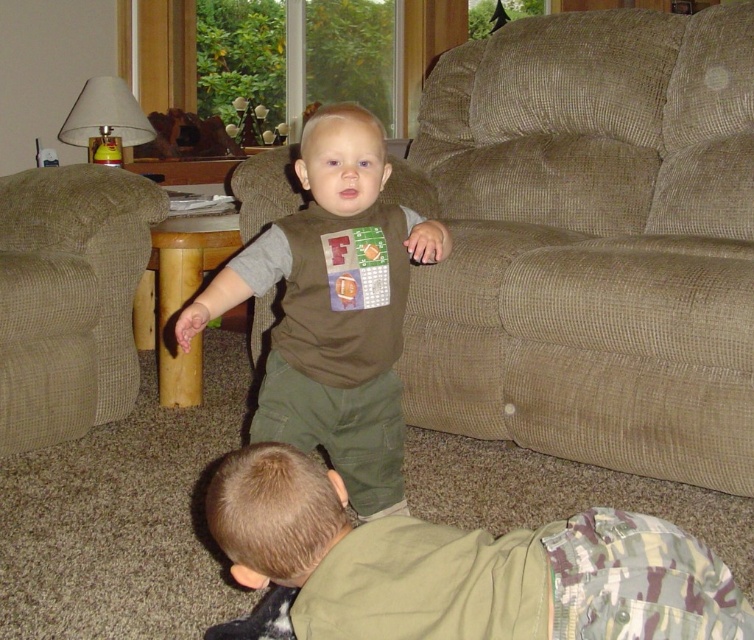
Question: Which of these objects is positioned closest to the camouflage pants at lower center?

Choices:
 (A) brown matte shirt at center
 (B) brown corduroy couch at center

Answer: (A)

Question: Does brown corduroy couch at center appear over beige corduroy armchair at left?

Choices:
 (A) no
 (B) yes

Answer: (B)

Question: Does camouflage pants at lower center have a larger size compared to brown matte shirt at center?

Choices:
 (A) no
 (B) yes

Answer: (A)

Question: Which is nearer to the brown matte shirt at center?

Choices:
 (A) brown corduroy couch at center
 (B) camouflage pants at lower center
 (C) beige corduroy armchair at left

Answer: (A)

Question: Does brown corduroy couch at center lie behind brown matte shirt at center?

Choices:
 (A) no
 (B) yes

Answer: (B)

Question: Among these points, which one is farthest from the camera?

Choices:
 (A) (360, 284)
 (B) (14, 179)
 (C) (558, 68)
 (D) (572, 547)

Answer: (C)